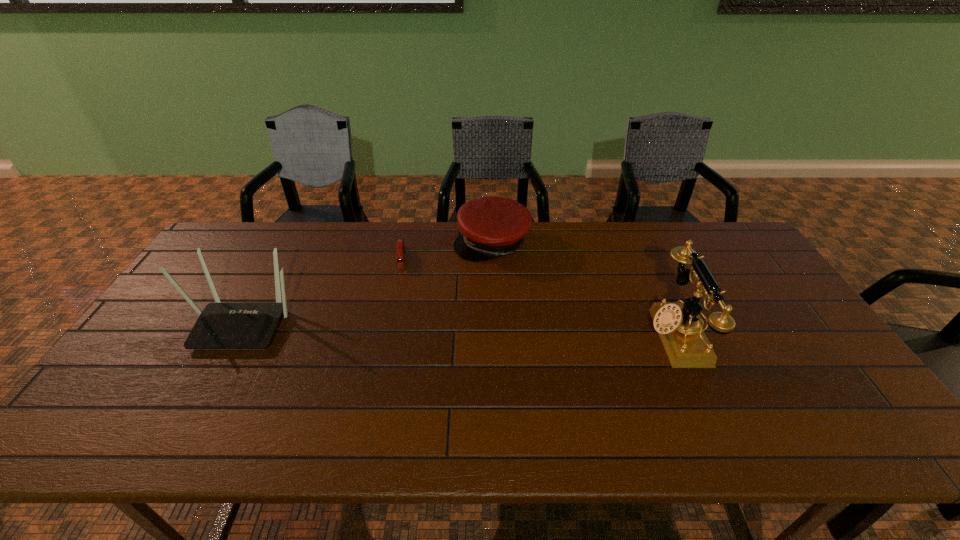
Locate an element on the screen. empty location between the rightmost object and the cap is located at coordinates (584, 289).

Find the location of a particular element. Image resolution: width=960 pixels, height=540 pixels. vacant space in between the third object from right to left and the second tallest object is located at coordinates (323, 291).

Where is `vacant area between the second tallest object and the telephone`? vacant area between the second tallest object and the telephone is located at coordinates [x=459, y=329].

You are a GUI agent. You are given a task and a screenshot of the screen. Output one action in this format:
    pyautogui.click(x=<x>, y=<y>)
    Task: Click on the vacant space that's between the second object from right to left and the rightmost object
    
    Given the screenshot: What is the action you would take?
    pyautogui.click(x=584, y=289)

Identify the location of vacant area that lies between the second object from right to left and the leftmost object. [x=368, y=283].

This screenshot has height=540, width=960. What are the coordinates of `free area in between the second object from right to left and the tallest object` in the screenshot? It's located at (584, 289).

Locate which object ranks third in proximity to the rightmost object. Please provide its 2D coordinates. Your answer should be formatted as a tuple, i.e. [(x, y)], where the tuple contains the x and y coordinates of a point satisfying the conditions above.

[(220, 325)]

Locate an element on the screen. The height and width of the screenshot is (540, 960). object that stands as the second closest to the stapler is located at coordinates (220, 325).

At what (x,y) coordinates should I click in order to perform the action: click on vacant point that satisfies the following two spatial constraints: 1. on the front-facing side of the third shortest object; 2. on the dial of the telephone. Please return your answer as a coordinate pair (x, y). Looking at the image, I should click on (237, 335).

Locate an element on the screen. This screenshot has height=540, width=960. free location that satisfies the following two spatial constraints: 1. on the front-facing side of the second tallest object; 2. on the dial of the telephone is located at coordinates (237, 335).